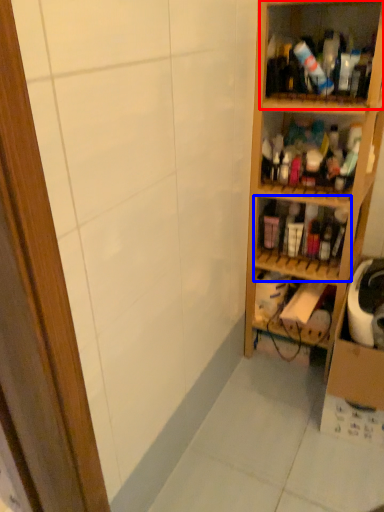
Question: Which object is closer to the camera taking this photo, shelf (highlighted by a red box) or shelf (highlighted by a blue box)?

Choices:
 (A) shelf
 (B) shelf

Answer: (A)